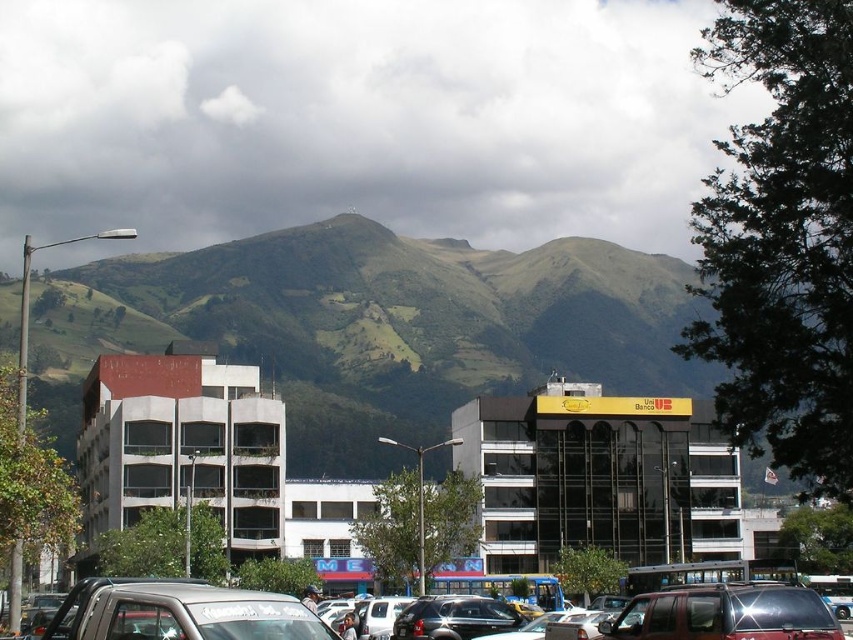
You are a delivery driver trying to park your vehicle in the parking lot. You have a silver metallic pickup truck at lower left. There is a space between two vehicles where the silver metallic suv at lower center is parked. Will your pickup truck fit into that space?

The silver metallic suv at lower center is wider than the silver metallic pickup truck at lower left. Since the space between the two vehicles is determined by the width of the SUV, your pickup truck should fit as it is narrower.

You are a pedestrian standing at the edge of the parking lot. You see the silver metallic pickup truck at lower left and the shiny black car at center. Which vehicle is closer to you?

The silver metallic pickup truck at lower left is closer to you because it is positioned over the shiny black car at center, indicating it is in front.

Based on the photo, you are a delivery driver who needs to park your metallic silver suv at center in the parking lot. The parking spot you want is at point (724, 612). Can you safely park there?

The metallic silver suv at center is already located at point (724, 612), so the parking spot is occupied.